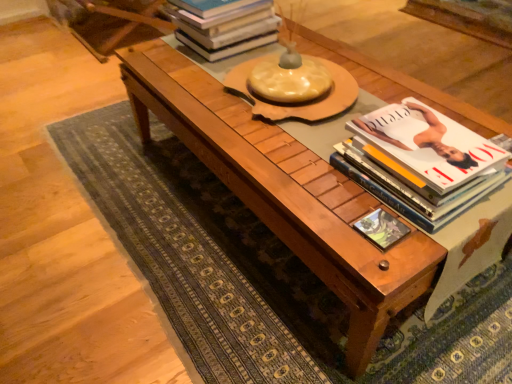
Question: Is matte green book at center bigger or smaller than wooden coffee table at center?

Choices:
 (A) small
 (B) big

Answer: (A)

Question: Is point (374, 220) positioned closer to the camera than point (387, 321)?

Choices:
 (A) closer
 (B) farther

Answer: (B)

Question: Estimate the real-world distances between objects in this image. Which object is closer to the wooden coffee table at center?

Choices:
 (A) matte green book at center
 (B) white glossy book at right, positioned as the second book in left-to-right order
 (C) hardcover books at upper center, which ranks as the first book in back-to-front order

Answer: (B)

Question: Based on their relative distances, which object is nearer to the hardcover books at upper center, which is the 1th book in top-to-bottom order?

Choices:
 (A) wooden coffee table at center
 (B) matte green book at center
 (C) white glossy book at right, which is the 1th book from bottom to top

Answer: (A)